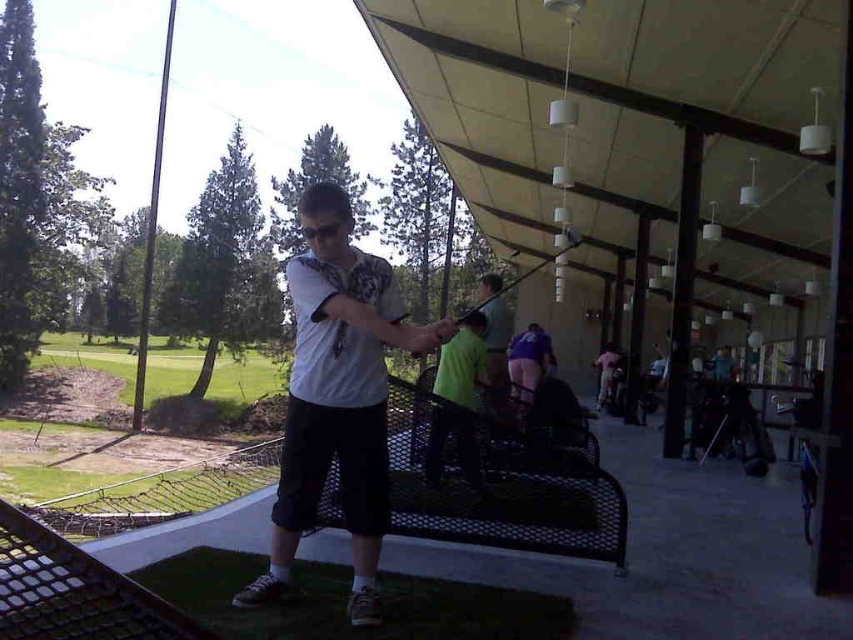
Is white matte shirt at center in front of neon green shirt at center?

Answer: Yes.

Does point (308, 406) lie in front of point (454, 410)?

Yes.

Is point (282, 506) in front of point (436, 376)?

Yes.

Locate an element on the screen. The image size is (853, 640). white matte shirt at center is located at coordinates (337, 396).

Is point (297, 355) positioned after point (540, 349)?

No, it is in front of (540, 349).

Can you confirm if white matte shirt at center is positioned to the right of purple fabric shorts at center?

In fact, white matte shirt at center is to the left of purple fabric shorts at center.

Is point (344, 483) positioned behind point (520, 392)?

No, (344, 483) is in front of (520, 392).

Where is `white matte shirt at center`? white matte shirt at center is located at coordinates (337, 396).

Which of these two, neon green shirt at center or purple fabric shorts at center, stands taller?

Standing taller between the two is neon green shirt at center.

Which is in front, point (457, 390) or point (514, 365)?

Positioned in front is point (457, 390).

Consider the image. Measure the distance between neon green shirt at center and camera.

neon green shirt at center and camera are 3.86 meters apart from each other.

Where is `neon green shirt at center`? neon green shirt at center is located at coordinates (457, 397).